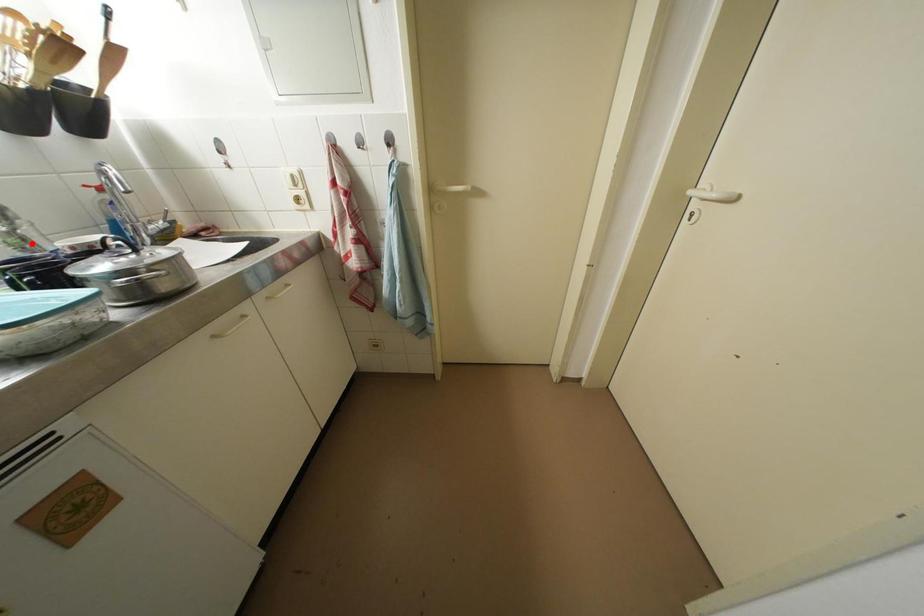
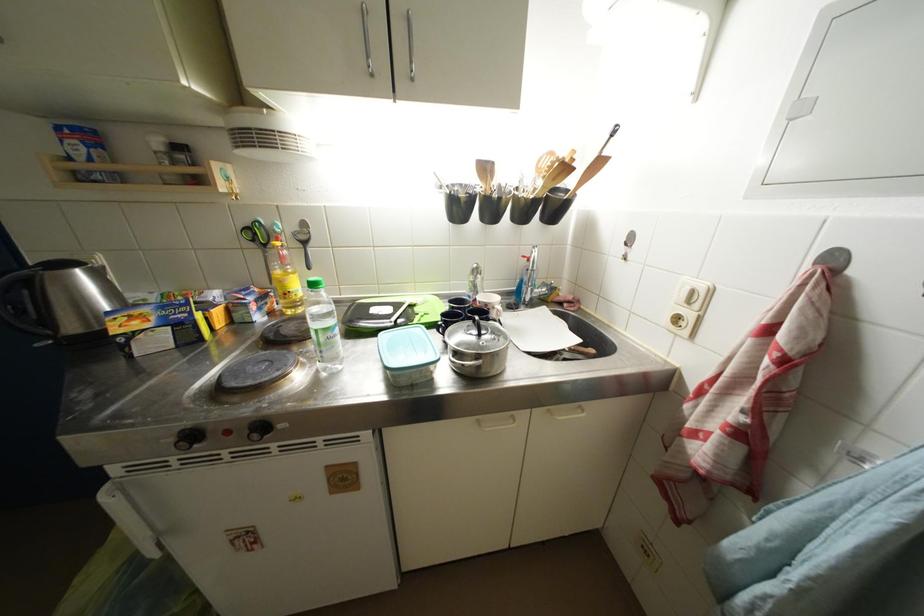
Question: I am providing you with two images of the same scene from different viewpoints. A red point is shown in image1. For the corresponding object point in image2, is it positioned nearer or farther from the camera?

Choices:
 (A) Nearer
 (B) Farther

Answer: (A)